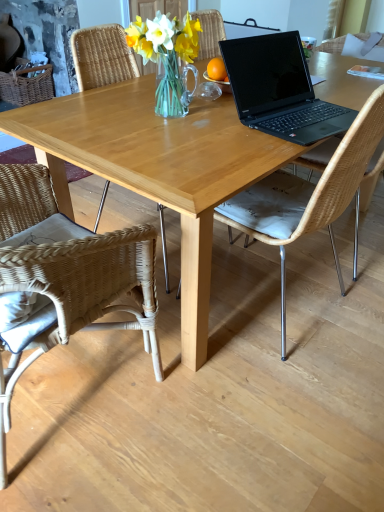
Question: From the image's perspective, is woven rattan chair at lower left, positioned as the second chair in right-to-left order, under light wood table at center?

Choices:
 (A) no
 (B) yes

Answer: (B)

Question: Are woven rattan chair at lower left, acting as the first chair starting from the left, and light wood table at center making contact?

Choices:
 (A) yes
 (B) no

Answer: (B)

Question: Is woven rattan chair at lower left, positioned as the second chair in right-to-left order, not within light wood table at center?

Choices:
 (A) yes
 (B) no

Answer: (A)

Question: Is woven rattan chair at lower left, acting as the first chair starting from the left, taller than light wood table at center?

Choices:
 (A) yes
 (B) no

Answer: (A)

Question: Considering the relative sizes of woven rattan chair at lower left, positioned as the second chair in right-to-left order, and light wood table at center in the image provided, is woven rattan chair at lower left, positioned as the second chair in right-to-left order, wider than light wood table at center?

Choices:
 (A) no
 (B) yes

Answer: (A)

Question: Is woven rattan chair at lower left, acting as the first chair starting from the left, facing away from light wood table at center?

Choices:
 (A) yes
 (B) no

Answer: (B)

Question: From a real-world perspective, is clear glass vase at center on light wood table at center?

Choices:
 (A) no
 (B) yes

Answer: (B)

Question: From the image's perspective, is clear glass vase at center located above light wood table at center?

Choices:
 (A) yes
 (B) no

Answer: (A)

Question: Is clear glass vase at center at the right side of light wood table at center?

Choices:
 (A) yes
 (B) no

Answer: (B)

Question: Can you confirm if clear glass vase at center is bigger than light wood table at center?

Choices:
 (A) yes
 (B) no

Answer: (B)

Question: Is clear glass vase at center far from light wood table at center?

Choices:
 (A) yes
 (B) no

Answer: (B)

Question: Is clear glass vase at center further to camera compared to light wood table at center?

Choices:
 (A) yes
 (B) no

Answer: (A)

Question: Does natural wicker chair at center, the second chair viewed from the left, turn towards light wood table at center?

Choices:
 (A) no
 (B) yes

Answer: (B)